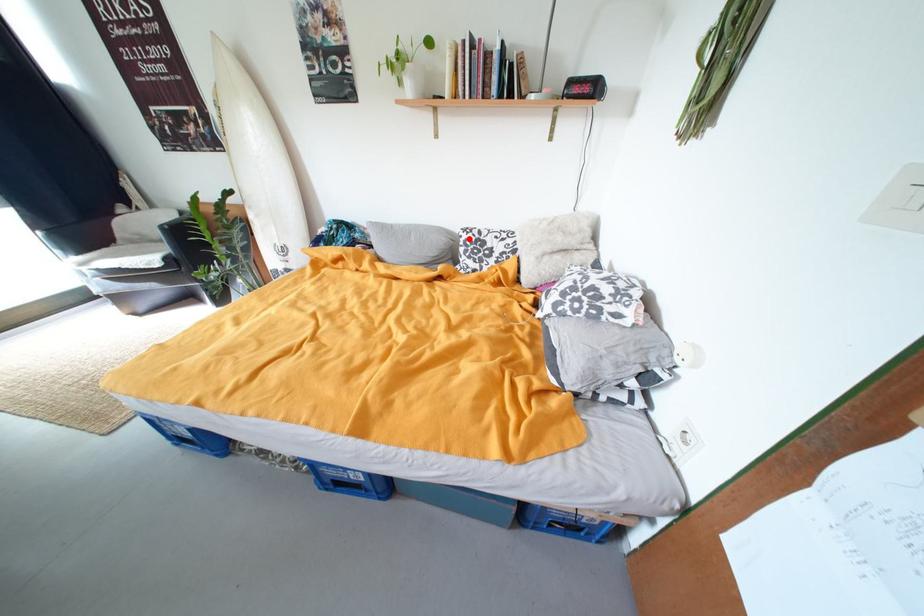
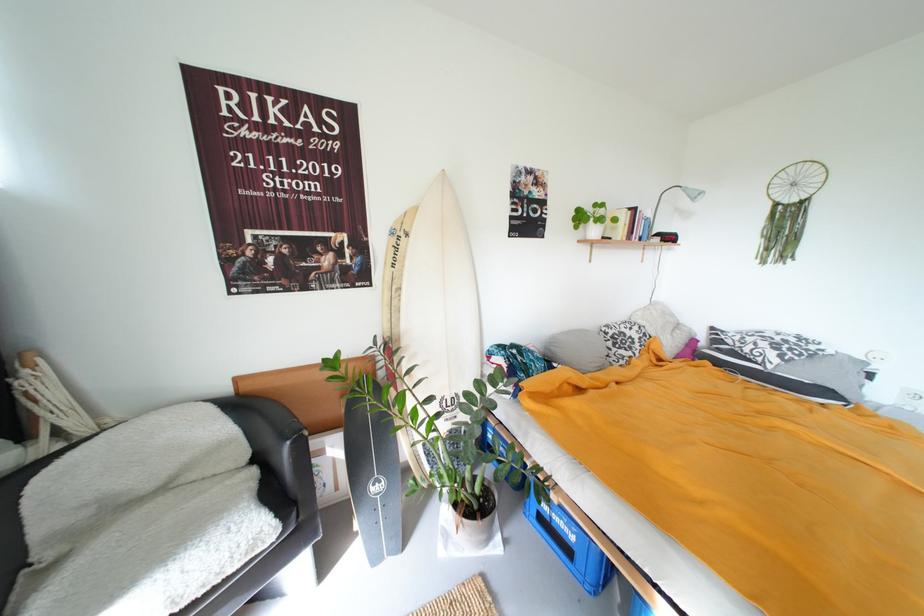
The point at the highlighted location is marked in the first image. Where is the corresponding point in the second image?

(614, 334)